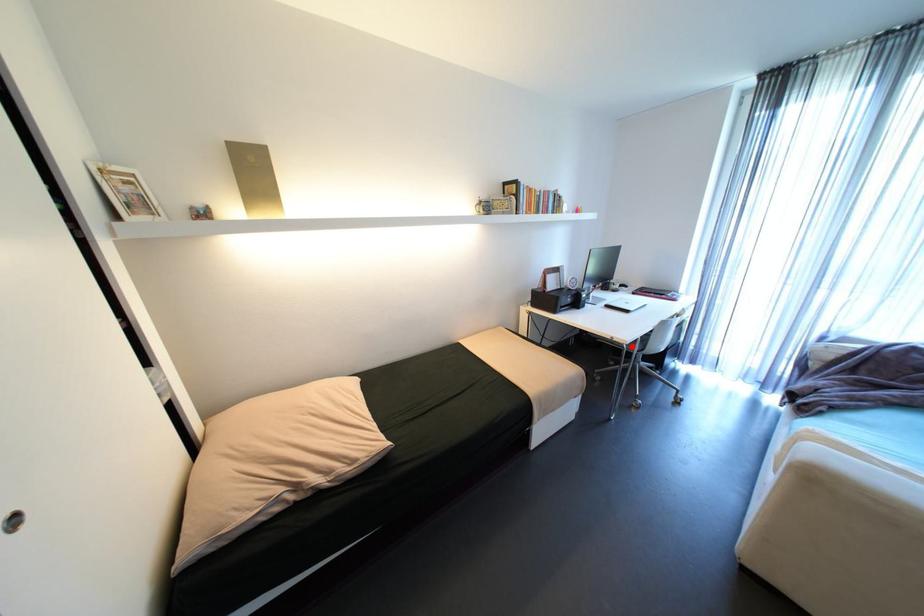
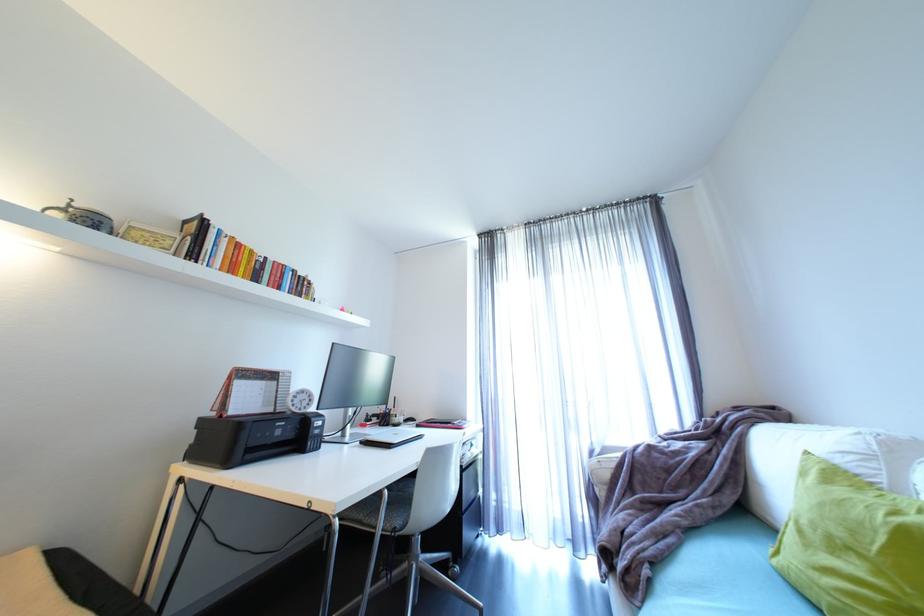
Question: I am providing you with two images of the same scene from different viewpoints. Given a red point in image1, look at the same physical point in image2. Is it:

Choices:
 (A) Closer to the viewpoint
 (B) Farther from the viewpoint

Answer: (A)